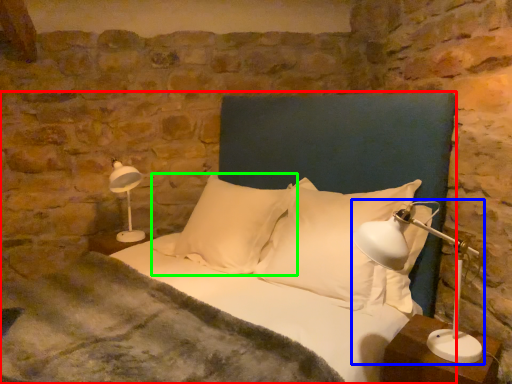
Question: Which is nearer to the bed (highlighted by a red box)? table lamp (highlighted by a blue box) or pillow (highlighted by a green box).

Choices:
 (A) table lamp
 (B) pillow

Answer: (B)